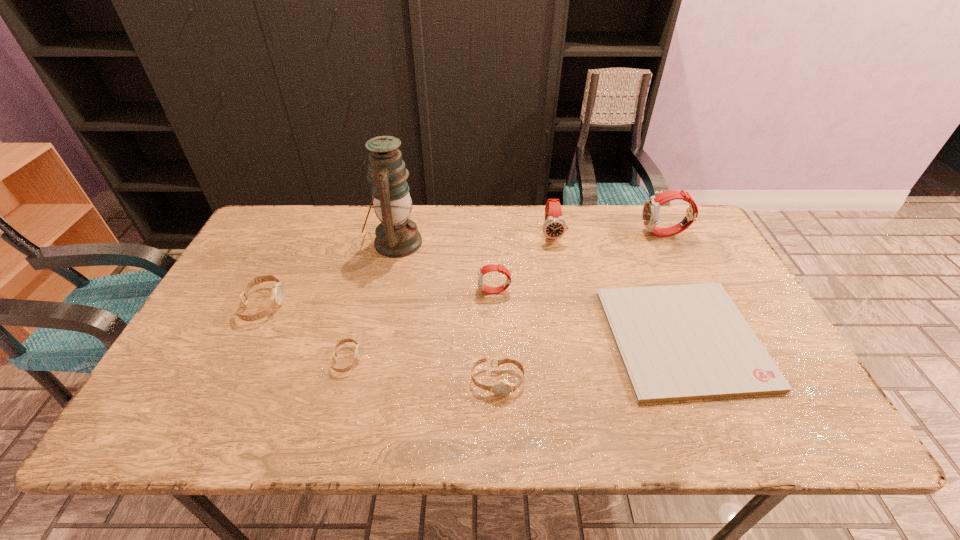
Locate an element on the screen. The height and width of the screenshot is (540, 960). watch located in the right edge section of the desktop is located at coordinates (650, 214).

This screenshot has height=540, width=960. Find the location of `clipboard that is at the right edge`. clipboard that is at the right edge is located at coordinates (678, 342).

Where is `object present at the far right corner`? Image resolution: width=960 pixels, height=540 pixels. object present at the far right corner is located at coordinates (650, 214).

Where is `object located in the near right corner section of the desktop`? This screenshot has height=540, width=960. object located in the near right corner section of the desktop is located at coordinates (678, 342).

At what (x,y) coordinates should I click in order to perform the action: click on free space at the far edge of the desktop. Please return your answer as a coordinate pair (x, y). The image size is (960, 540). Looking at the image, I should click on (515, 239).

Identify the location of vacant space at the near edge. Image resolution: width=960 pixels, height=540 pixels. coord(691,439).

Image resolution: width=960 pixels, height=540 pixels. In the image, there is a desktop. In order to click on vacant space at the left edge in this screenshot , I will do `click(201, 330)`.

The image size is (960, 540). In order to click on free point at the right edge in this screenshot , I will do `click(744, 300)`.

In the image, there is a desktop. Where is `blank space at the far left corner`? The height and width of the screenshot is (540, 960). blank space at the far left corner is located at coordinates (296, 244).

The image size is (960, 540). I want to click on free point between the second red watch from left to right and the oil lamp, so click(473, 238).